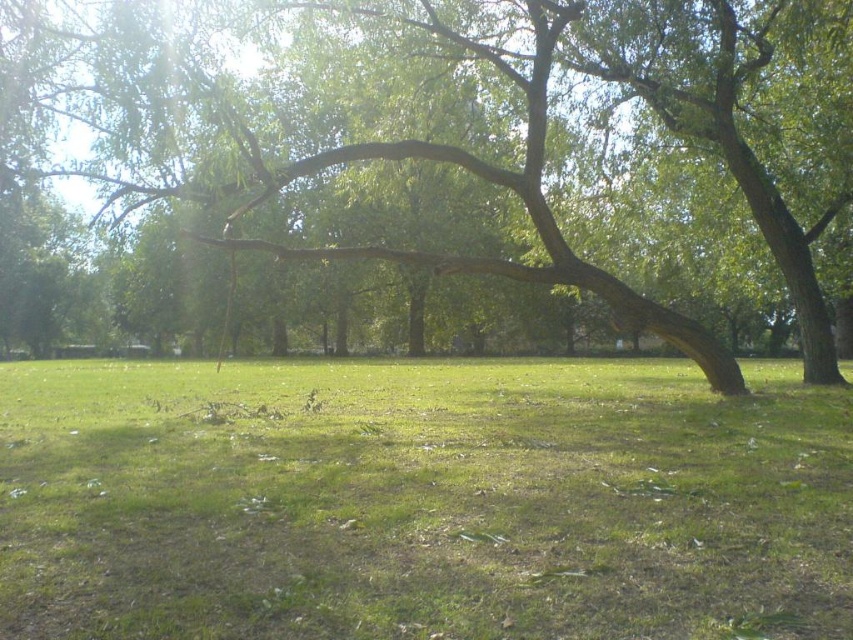
Question: Which of the following is the farthest from the observer?

Choices:
 (A) (567, 280)
 (B) (553, 452)

Answer: (A)

Question: Is green grass at center to the right of green rough bark tree at center from the viewer's perspective?

Choices:
 (A) yes
 (B) no

Answer: (B)

Question: Observing the image, what is the correct spatial positioning of green grass at center in reference to green rough bark tree at center?

Choices:
 (A) right
 (B) left

Answer: (B)

Question: Can you confirm if green grass at center is bigger than green rough bark tree at center?

Choices:
 (A) yes
 (B) no

Answer: (B)